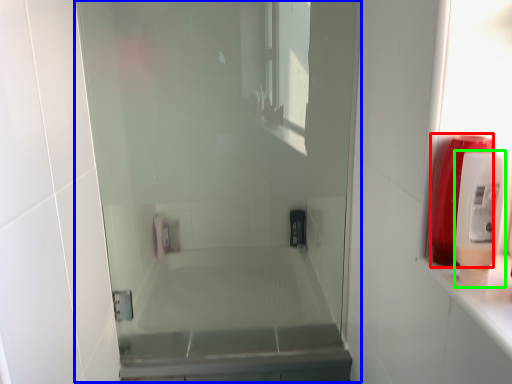
Question: Which object is the farthest from soap dispenser (highlighted by a red box)? Choose among these: screen door (highlighted by a blue box) or soap dispenser (highlighted by a green box).

Choices:
 (A) screen door
 (B) soap dispenser

Answer: (A)